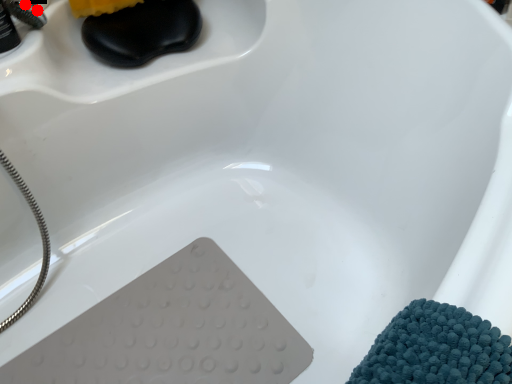
Question: Two points are circled on the image, labeled by A and B beside each circle. Among these points, which one is nearest to the camera?

Choices:
 (A) A is closer
 (B) B is closer

Answer: (B)